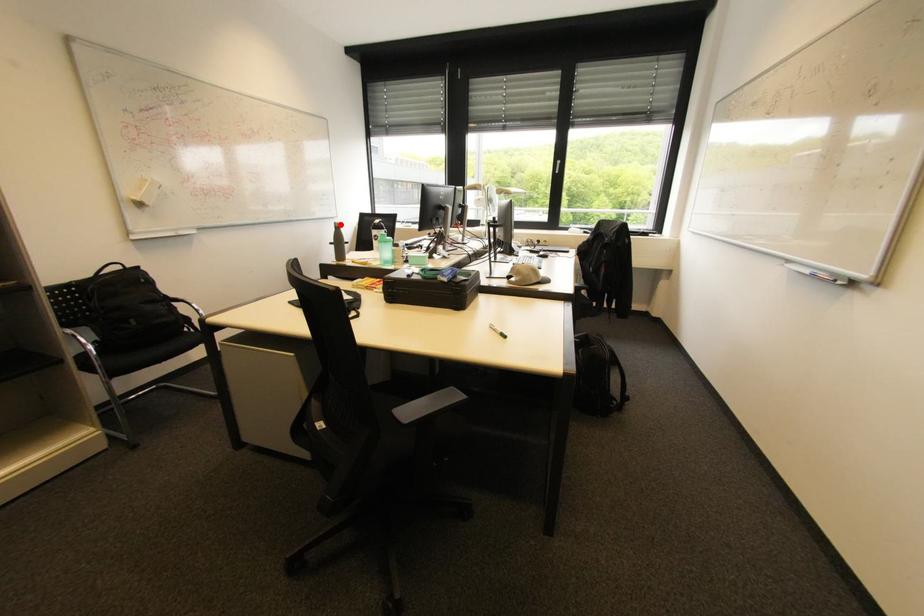
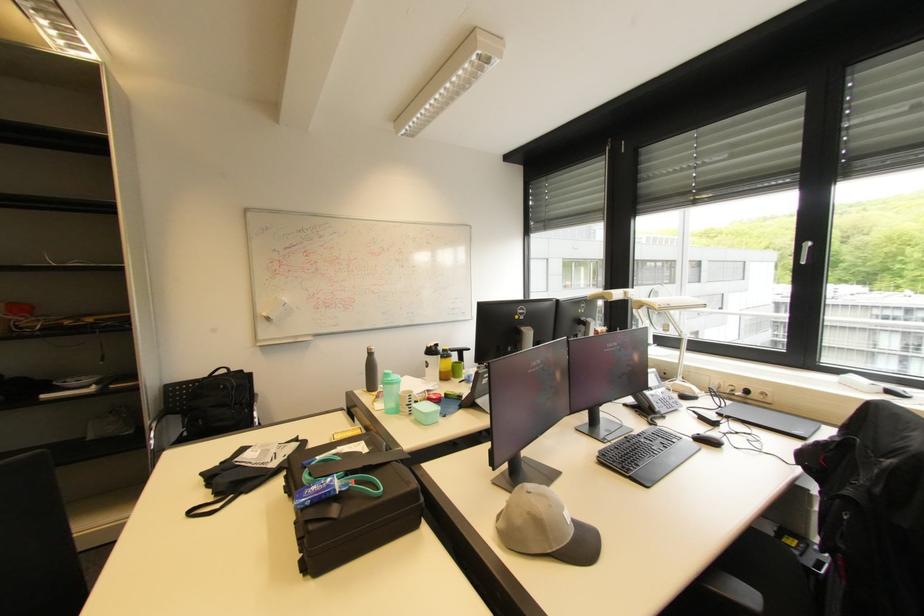
The point at the highlighted location is marked in the first image. Where is the corresponding point in the second image?

(372, 350)